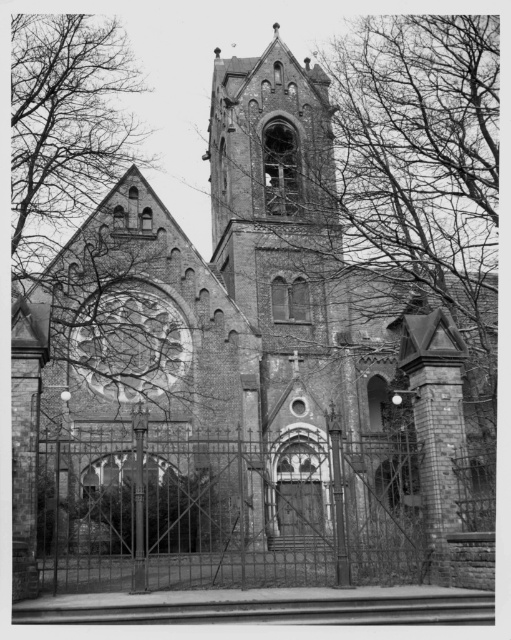
Question: Which point appears closest to the camera in this image?

Choices:
 (A) (122, 563)
 (B) (34, 237)

Answer: (A)

Question: Which point is farther to the camera?

Choices:
 (A) (13, 72)
 (B) (223, 449)

Answer: (A)

Question: Is iron gate at center smaller than bare branches at upper left?

Choices:
 (A) no
 (B) yes

Answer: (B)

Question: Observing the image, what is the correct spatial positioning of iron gate at center in reference to bare branches at upper left?

Choices:
 (A) below
 (B) above

Answer: (A)

Question: Which point is closer to the camera?

Choices:
 (A) (26, 260)
 (B) (250, 467)

Answer: (B)

Question: Is iron gate at center to the left of bare branches at upper left from the viewer's perspective?

Choices:
 (A) yes
 (B) no

Answer: (B)